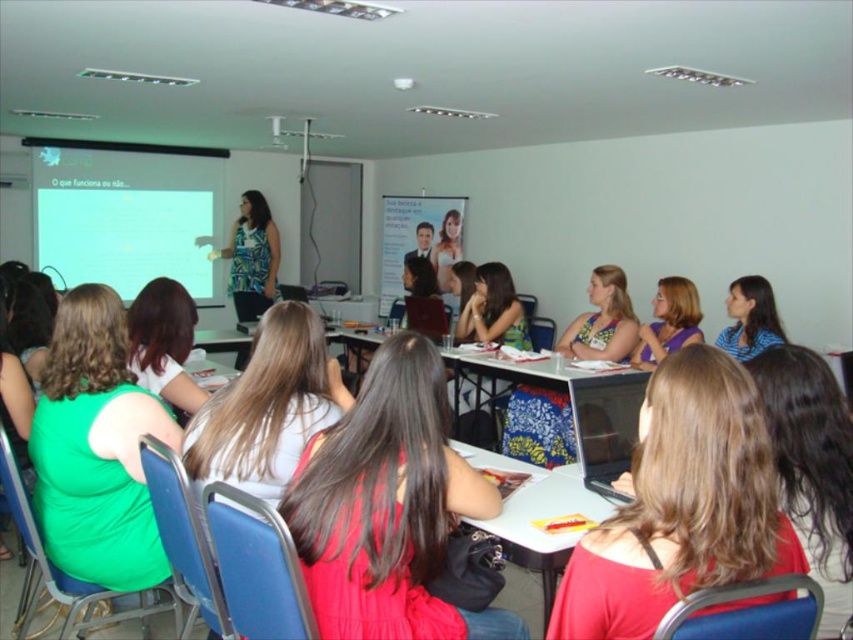
Is matte white shirt at center closer to the viewer compared to blue fabric shirt at center?

That is True.

At what (x,y) coordinates should I click in order to perform the action: click on matte white shirt at center. Please return your answer as a coordinate pair (x, y). The image size is (853, 640). Looking at the image, I should click on (267, 406).

In order to click on matte white shirt at center in this screenshot , I will do `click(267, 406)`.

Can you confirm if green fabric dress at lower left is smaller than printed fabric shirt at center?

Indeed, green fabric dress at lower left has a smaller size compared to printed fabric shirt at center.

Is green fabric dress at lower left positioned before printed fabric shirt at center?

Yes.

Who is more forward, (134, 362) or (262, 301)?

Point (134, 362) is in front.

The width and height of the screenshot is (853, 640). Identify the location of green fabric dress at lower left. (164, 342).

Between smooth red hair at center and green fabric dress at lower left, which one has more height?

smooth red hair at center

Does smooth red hair at center appear on the right side of green fabric dress at lower left?

Yes, smooth red hair at center is to the right of green fabric dress at lower left.

Is point (784, 360) behind point (173, 291)?

No, (784, 360) is in front of (173, 291).

I want to click on smooth red hair at center, so click(809, 449).